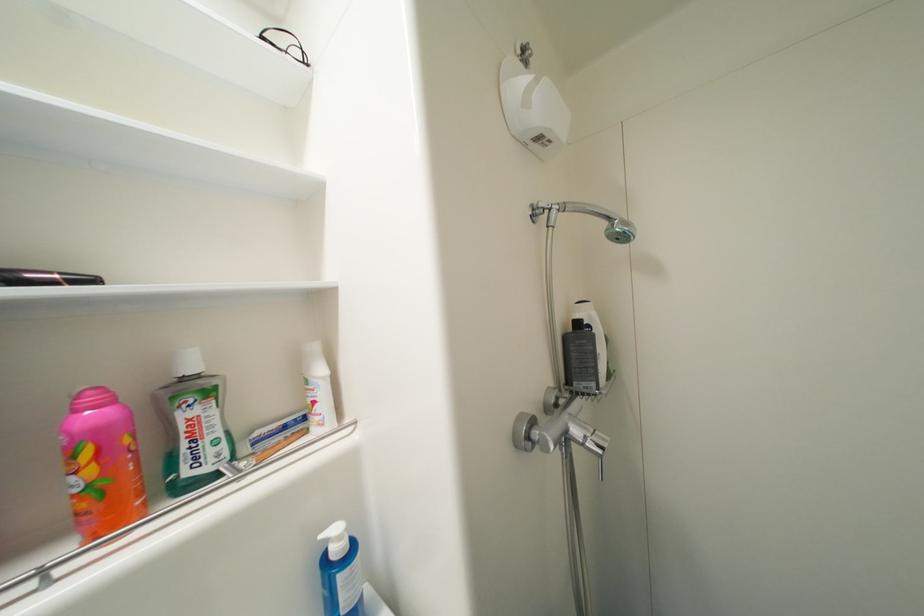
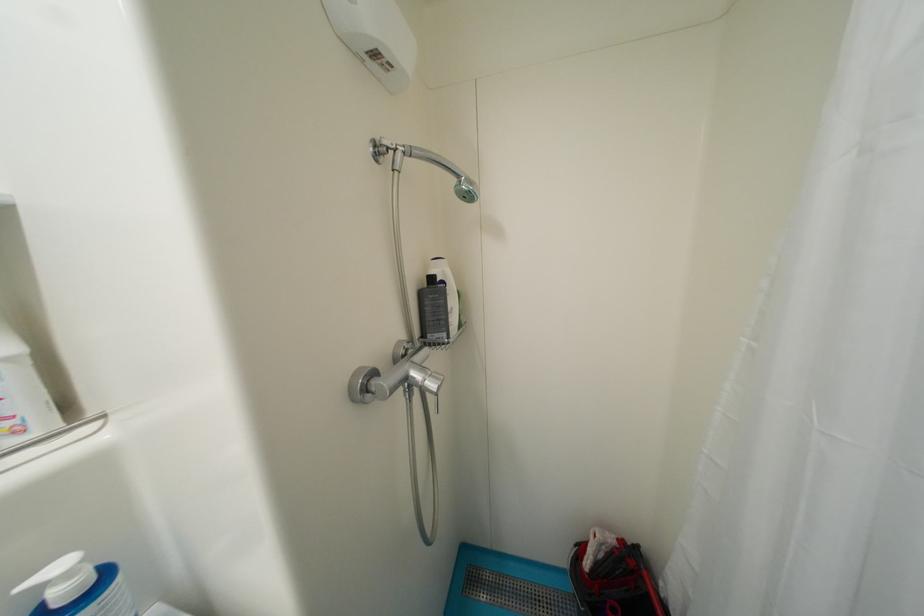
In the second image, find the point that corresponds to point 346,540 in the first image.

(75, 576)